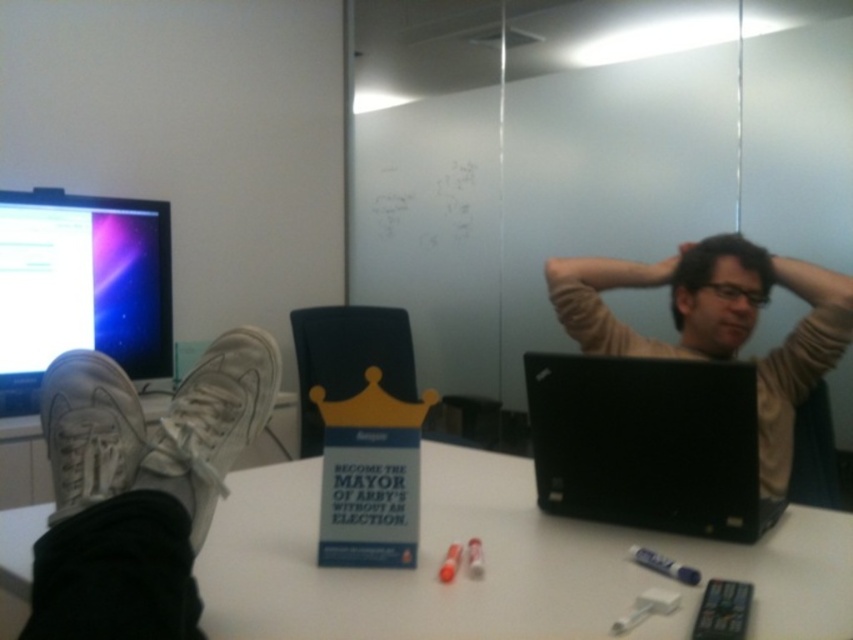
Question: Among these points, which one is nearest to the camera?

Choices:
 (A) (714, 294)
 (B) (701, 333)
 (C) (59, 401)
 (D) (570, 554)

Answer: (C)

Question: Among these objects, which one is farthest from the camera?

Choices:
 (A) black matte laptop at center
 (B) white canvas shoe at lower left

Answer: (A)

Question: Considering the relative positions of black matte laptop at center and matte beige sweater at center in the image provided, where is black matte laptop at center located with respect to matte beige sweater at center?

Choices:
 (A) left
 (B) right

Answer: (A)

Question: Which point is closer to the camera taking this photo?

Choices:
 (A) (459, 621)
 (B) (251, 369)
 (C) (680, 326)
 (D) (579, 422)

Answer: (A)

Question: Considering the relative positions of white suede shoe at lower left and matte brown hair at upper center in the image provided, where is white suede shoe at lower left located with respect to matte brown hair at upper center?

Choices:
 (A) right
 (B) left

Answer: (B)

Question: Can you confirm if white suede shoe at lower left is smaller than matte brown hair at upper center?

Choices:
 (A) no
 (B) yes

Answer: (B)